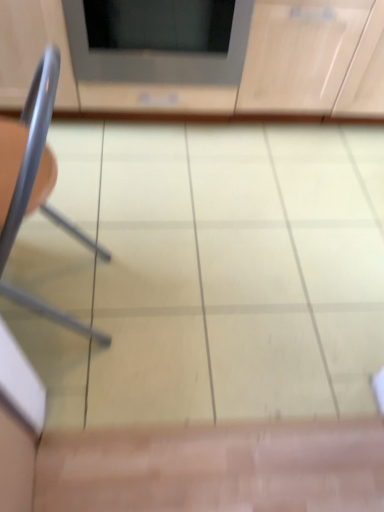
Where is `matte wood cabinet at upper center`? This screenshot has width=384, height=512. matte wood cabinet at upper center is located at coordinates (314, 59).

What is the approximate width of metallic gray chair at left?

It is 14.51 inches.

The width and height of the screenshot is (384, 512). Describe the element at coordinates (31, 145) in the screenshot. I see `metallic gray chair at left` at that location.

You are a GUI agent. You are given a task and a screenshot of the screen. Output one action in this format:
    pyautogui.click(x=<x>, y=<y>)
    Task: Click on the matte wood cabinet at upper center
    This screenshot has width=384, height=512.
    Given the screenshot: What is the action you would take?
    pyautogui.click(x=314, y=59)

Is matte wood cabinet at upper center with metallic gray chair at left?

No, matte wood cabinet at upper center is not beside metallic gray chair at left.

Is point (375, 115) positioned in front of point (2, 266)?

No.

Is matte wood cabinet at upper center aimed at metallic gray chair at left?

Yes, matte wood cabinet at upper center is oriented towards metallic gray chair at left.

Is matte gray microwave at upper center in front of or behind matte wood cabinet at upper center in the image?

matte gray microwave at upper center is positioned farther from the viewer than matte wood cabinet at upper center.

Is matte gray microwave at upper center not inside matte wood cabinet at upper center?

No, matte gray microwave at upper center is not outside of matte wood cabinet at upper center.

Where is `appliance above the matte wood cabinet at upper center (from the image's perspective)`? appliance above the matte wood cabinet at upper center (from the image's perspective) is located at coordinates (158, 53).

Which is nearer, (196, 101) or (372, 101)?

Clearly, point (196, 101) is closer to the camera than point (372, 101).

From the image's perspective, which one is positioned higher, metallic gray chair at left or matte wood cabinet at upper center?

From the image's view, matte wood cabinet at upper center is above.

Considering the relative sizes of metallic gray chair at left and matte wood cabinet at upper center in the image provided, is metallic gray chair at left thinner than matte wood cabinet at upper center?

Correct, the width of metallic gray chair at left is less than that of matte wood cabinet at upper center.

In order to click on cabinetry on the right of metallic gray chair at left in this screenshot , I will do `click(314, 59)`.

Could you tell me if metallic gray chair at left is facing matte wood cabinet at upper center?

No.

Is matte wood cabinet at upper center facing towards matte gray microwave at upper center?

Yes, matte wood cabinet at upper center is oriented towards matte gray microwave at upper center.

Which object is closer to the camera, matte wood cabinet at upper center or matte gray microwave at upper center?

matte wood cabinet at upper center is in front.

Choose the correct answer: Is matte wood cabinet at upper center inside matte gray microwave at upper center or outside it?

The correct answer is: outside.

Considering the sizes of objects matte wood cabinet at upper center and matte gray microwave at upper center in the image provided, who is smaller, matte wood cabinet at upper center or matte gray microwave at upper center?

matte gray microwave at upper center is smaller.

Is metallic gray chair at left located outside matte gray microwave at upper center?

Yes, metallic gray chair at left is not within matte gray microwave at upper center.

Is metallic gray chair at left taller than matte gray microwave at upper center?

Correct, metallic gray chair at left is much taller as matte gray microwave at upper center.

From a real-world perspective, which object rests below the other?

matte gray microwave at upper center, from a real-world perspective.

Is metallic gray chair at left at the left side of matte gray microwave at upper center?

Yes.

Are matte gray microwave at upper center and metallic gray chair at left making contact?

matte gray microwave at upper center and metallic gray chair at left are not in contact.

Between matte gray microwave at upper center and metallic gray chair at left, which one has more height?

metallic gray chair at left.

Which object is thinner, matte gray microwave at upper center or metallic gray chair at left?

metallic gray chair at left is thinner.

Considering the positions of objects matte gray microwave at upper center and metallic gray chair at left in the image provided, who is behind, matte gray microwave at upper center or metallic gray chair at left?

matte gray microwave at upper center is further from the camera.

Identify the location of cabinetry behind the metallic gray chair at left. (314, 59).

Identify the location of appliance above the matte wood cabinet at upper center (from a real-world perspective). (158, 53).

From the image, which object appears to be farther from matte gray microwave at upper center, matte wood cabinet at upper center or metallic gray chair at left?

metallic gray chair at left is further to matte gray microwave at upper center.

Which object lies further to the anchor point matte wood cabinet at upper center, matte gray microwave at upper center or metallic gray chair at left?

The object further to matte wood cabinet at upper center is metallic gray chair at left.

When comparing their distances from metallic gray chair at left, does matte gray microwave at upper center or matte wood cabinet at upper center seem closer?

matte gray microwave at upper center is closer to metallic gray chair at left.

Estimate the real-world distances between objects in this image. Which object is further from matte gray microwave at upper center, metallic gray chair at left or matte wood cabinet at upper center?

metallic gray chair at left.

Based on their spatial positions, is metallic gray chair at left or matte gray microwave at upper center further from matte wood cabinet at upper center?

Among the two, metallic gray chair at left is located further to matte wood cabinet at upper center.

From the image, which object appears to be farther from metallic gray chair at left, matte wood cabinet at upper center or matte gray microwave at upper center?

Based on the image, matte wood cabinet at upper center appears to be further to metallic gray chair at left.

Where is `cabinetry between matte gray microwave at upper center and metallic gray chair at left from top to bottom`? cabinetry between matte gray microwave at upper center and metallic gray chair at left from top to bottom is located at coordinates (314, 59).